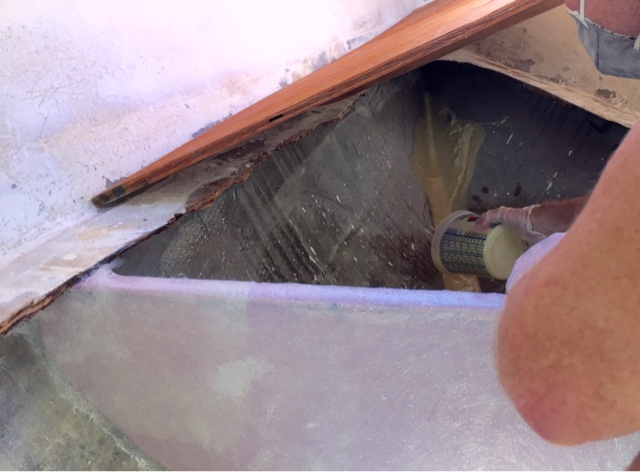
You are a GUI agent. You are given a task and a screenshot of the screen. Output one action in this format:
    pyautogui.click(x=<x>, y=<y>)
    Task: Click on the cup
    The width and height of the screenshot is (640, 472).
    Given the screenshot: What is the action you would take?
    pyautogui.click(x=467, y=251)